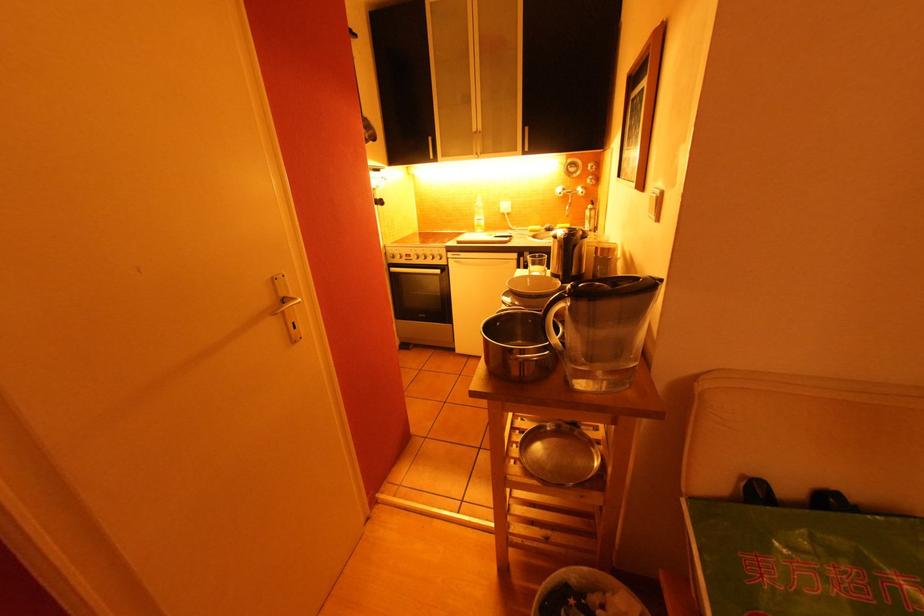
Identify the location of sofa sitting surface. (845, 565).